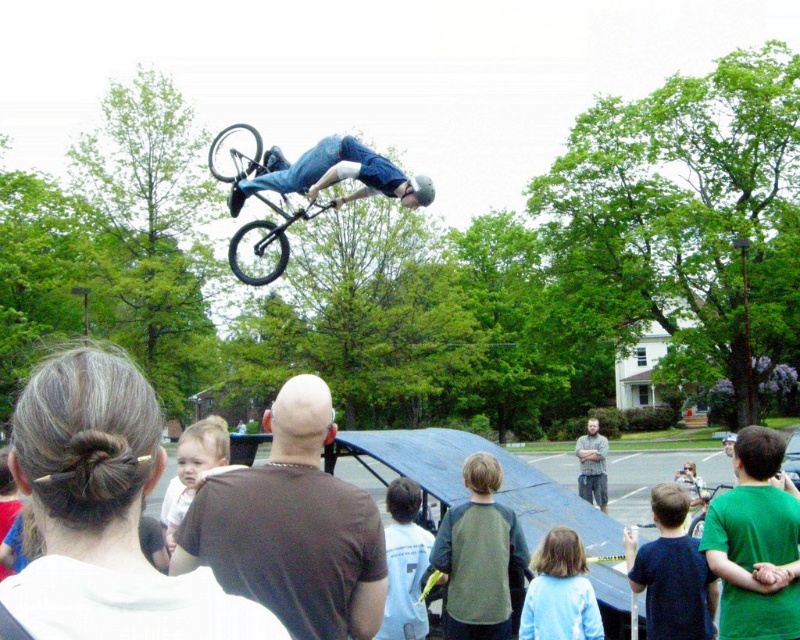
Question: In this image, where is green matte shirt at lower right located relative to black matte bicycle at center?

Choices:
 (A) above
 (B) below

Answer: (B)

Question: Does black matte bicycle at center come in front of light blue jersey at center?

Choices:
 (A) no
 (B) yes

Answer: (A)

Question: Does brown cotton shirt at center come behind green raglan shirt at center?

Choices:
 (A) yes
 (B) no

Answer: (B)

Question: Which is nearer to the green raglan shirt at center?

Choices:
 (A) light blue shirt at lower center
 (B) green matte shirt at lower right
 (C) white hair bun at upper left
 (D) black matte bicycle at center

Answer: (A)

Question: Which of the following is the closest to the observer?

Choices:
 (A) black matte bicycle at center
 (B) light blue shirt at lower center
 (C) green matte shirt at lower right
 (D) shiny metallic bicycle at center

Answer: (C)

Question: Which point is farther to the camera?

Choices:
 (A) (674, 522)
 (B) (454, 541)

Answer: (B)